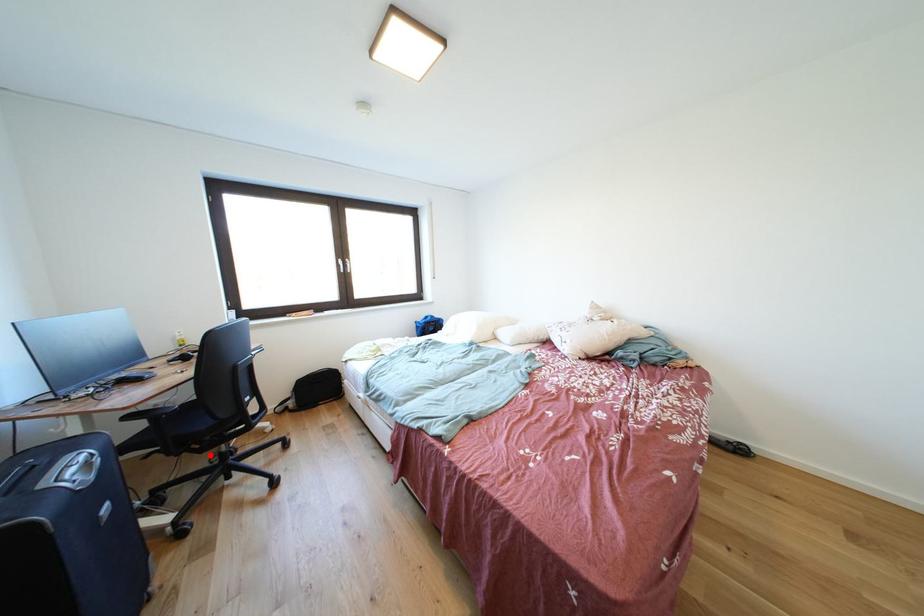
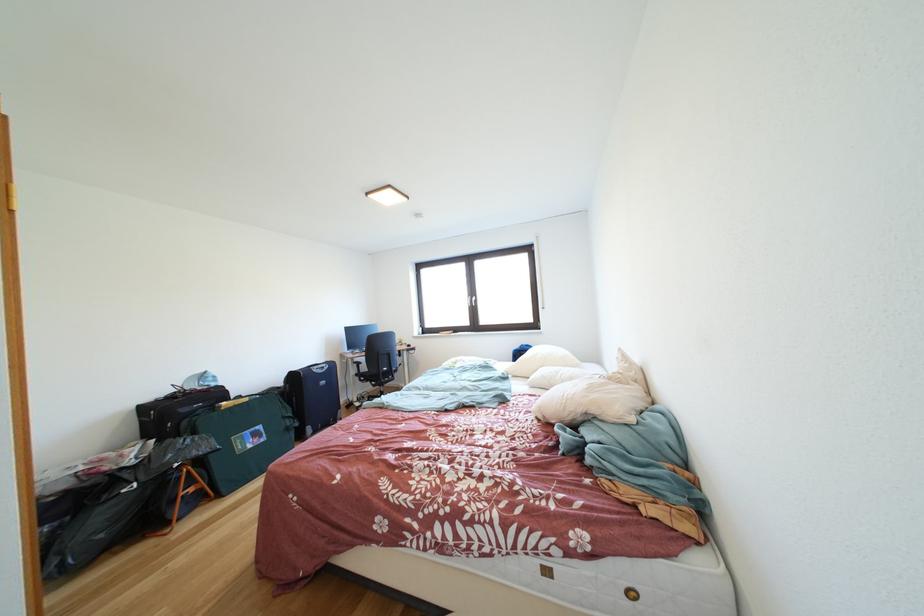
The point at the highlighted location is marked in the first image. Where is the corresponding point in the second image?

(383, 391)